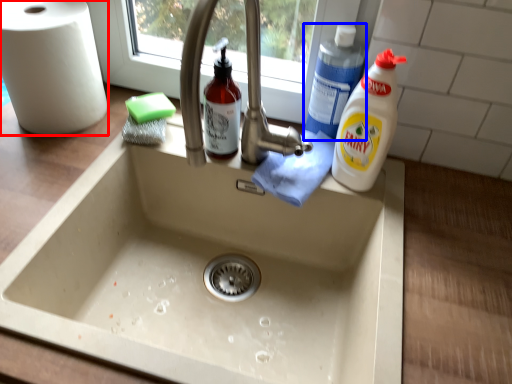
Question: Among these objects, which one is farthest to the camera, paper towel (highlighted by a red box) or cleaning product (highlighted by a blue box)?

Choices:
 (A) paper towel
 (B) cleaning product

Answer: (B)